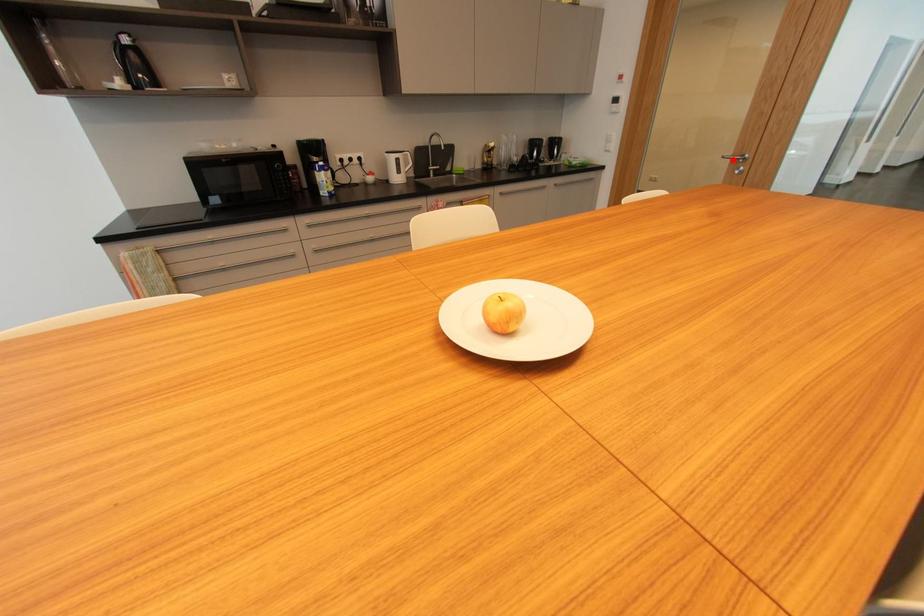
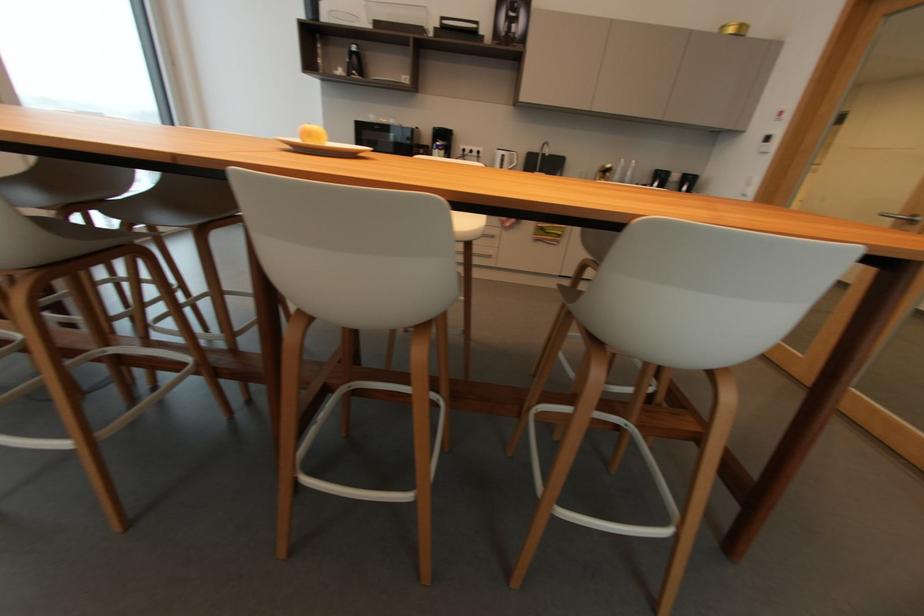
Locate, in the second image, the point that corresponds to the highlighted location in the first image.

(896, 219)